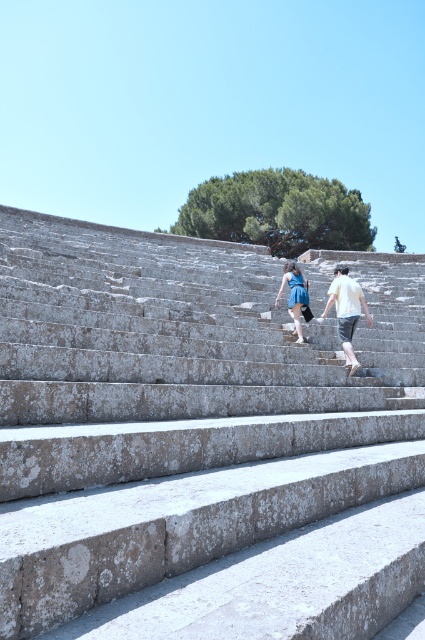
You are standing at the bottom of the stone steps and want to determine which person is taller based on their clothing. Which one is taller between the white cotton shirt at center and the blue denim dress at center?

The white cotton shirt at center is much taller than the blue denim dress at center, so the person wearing the white cotton shirt at center is taller.

You are a photographer trying to capture a photo of the gray stone steps at center and the blue denim dress at center. Since you want to ensure both are clearly visible, which object should you focus on first considering their sizes?

The gray stone steps at center is larger in size than blue denim dress at center, so you should focus on the gray stone steps at center first to ensure it is in clear focus before adjusting for the smaller blue denim dress at center.

Based on the photo, you are a photographer standing at the bottom of the stone steps. You want to take a photo of the white cotton shirt at center and blue denim dress at center so that both are in focus. The camera you are using has a depth of field that can cover 24 inches. Will both subjects be in focus?

The white cotton shirt at center and blue denim dress at center are 24.42 inches apart from each other. Since the camera can only cover 24 inches, the distance between them exceeds the depth of field limit. Therefore, both subjects may not be in focus simultaneously.